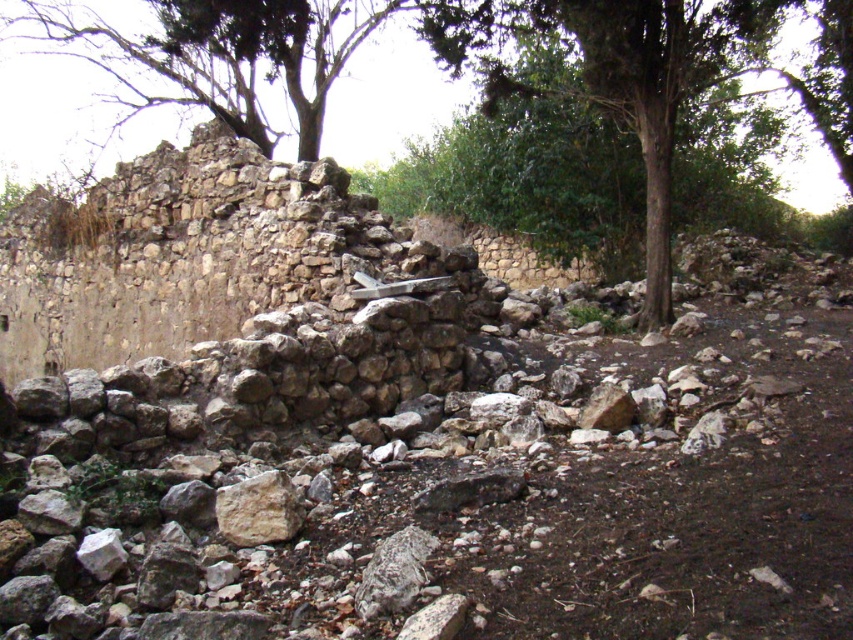
Does green leafy tree at upper center have a greater height compared to green leafy tree at center?

Indeed, green leafy tree at upper center has a greater height compared to green leafy tree at center.

Which is above, green leafy tree at upper center or green leafy tree at center?

Positioned higher is green leafy tree at upper center.

Describe the element at coordinates (96, 83) in the screenshot. I see `green leafy tree at upper center` at that location.

Where is `green leafy tree at upper center`? This screenshot has height=640, width=853. green leafy tree at upper center is located at coordinates (96, 83).

Which is in front, point (201, 52) or point (268, 492)?

Positioned in front is point (268, 492).

Is point (119, 44) positioned before point (270, 513)?

No, it is not.

Locate an element on the screen. green leafy tree at upper center is located at coordinates (96, 83).

In the scene shown: Can you confirm if green leafy tree at center is positioned to the right of smooth beige rock at center?

Indeed, green leafy tree at center is positioned on the right side of smooth beige rock at center.

Can you confirm if green leafy tree at center is wider than smooth beige rock at center?

Correct, the width of green leafy tree at center exceeds that of smooth beige rock at center.

The image size is (853, 640). What do you see at coordinates (650, 76) in the screenshot?
I see `green leafy tree at center` at bounding box center [650, 76].

Where is `green leafy tree at center`? The height and width of the screenshot is (640, 853). green leafy tree at center is located at coordinates point(650,76).